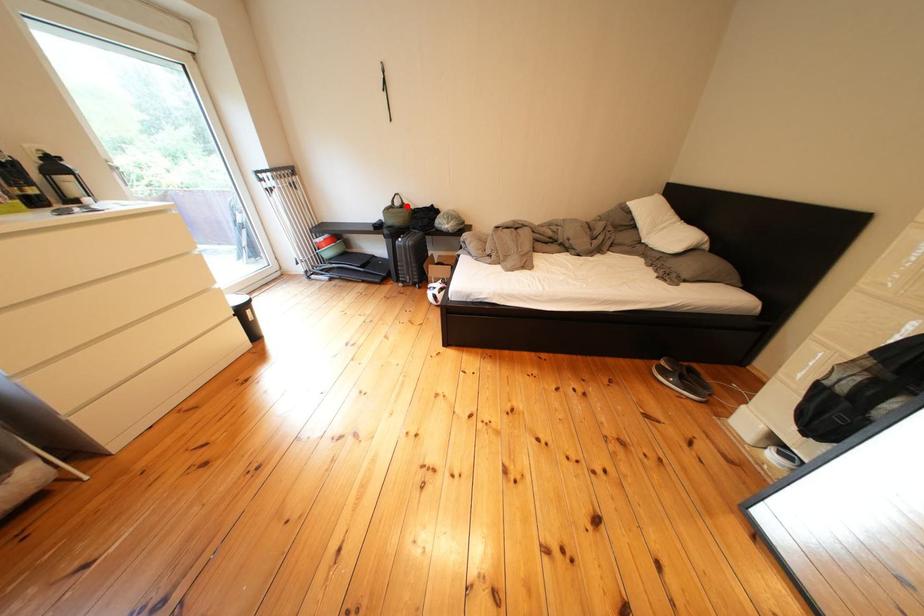
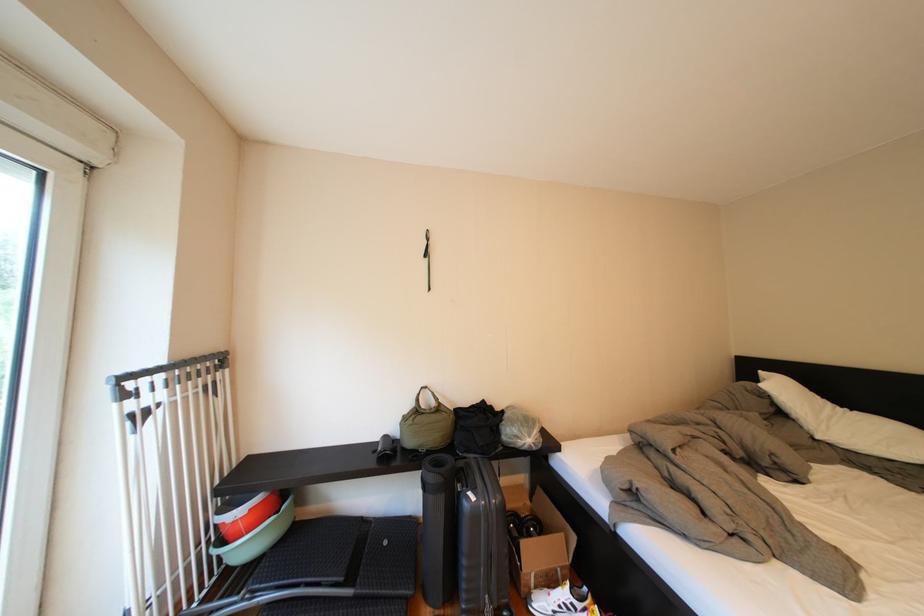
Question: I am providing you with two images of the same scene from different viewpoints. In image1, a red point is highlighted. Considering the same 3D point in image2, which of the following is correct?

Choices:
 (A) It is closer
 (B) It is farther

Answer: (B)